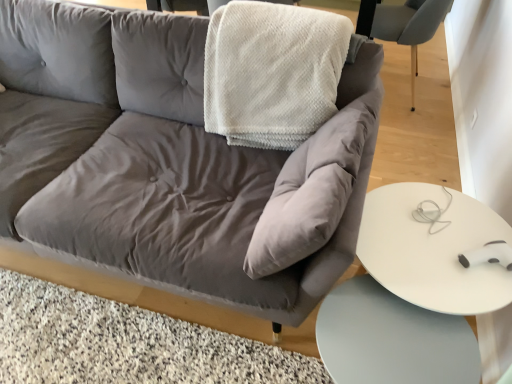
Question: In the image, is white glossy table at lower right, marked as the first table in a top-to-bottom arrangement, positioned in front of or behind white textured blanket at upper center?

Choices:
 (A) behind
 (B) front

Answer: (B)

Question: Is point (358, 251) positioned closer to the camera than point (294, 97)?

Choices:
 (A) farther
 (B) closer

Answer: (B)

Question: Which object is positioned farthest from the white glossy table at lower right, marked as the 1th table in a bottom-to-top arrangement?

Choices:
 (A) white glossy table at lower right, the 2th table positioned from the bottom
 (B) velvet gray couch at center
 (C) matte gray chair at upper right
 (D) white textured blanket at upper center

Answer: (C)

Question: Estimate the real-world distances between objects in this image. Which object is farther from the white glossy table at lower right, marked as the first table in a top-to-bottom arrangement?

Choices:
 (A) white glossy table at lower right, the second table in the top-to-bottom sequence
 (B) white textured blanket at upper center
 (C) velvet gray couch at center
 (D) matte gray chair at upper right

Answer: (D)